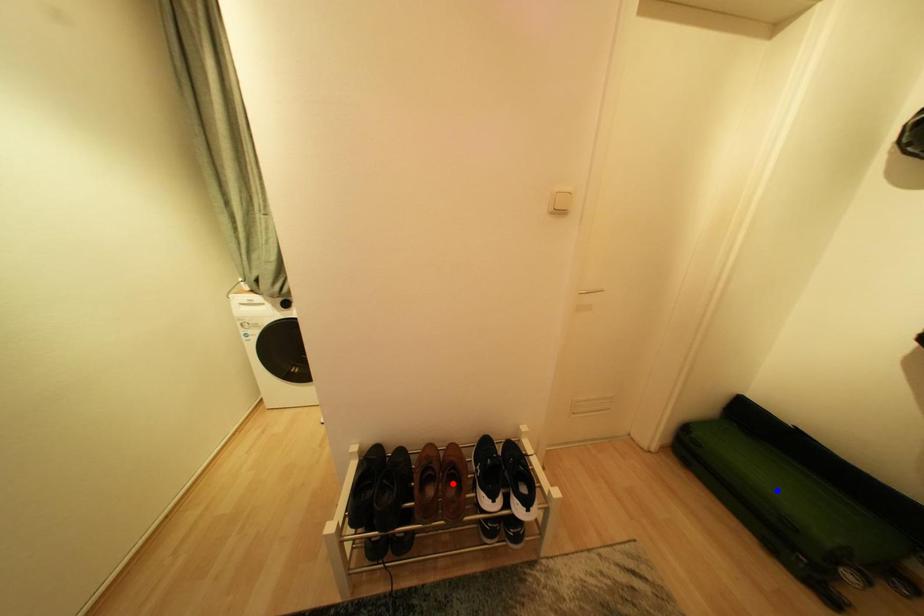
Question: In the image, two points are highlighted. Which point is nearer to the camera? Reply with the corresponding letter.

Choices:
 (A) blue point
 (B) red point

Answer: (A)